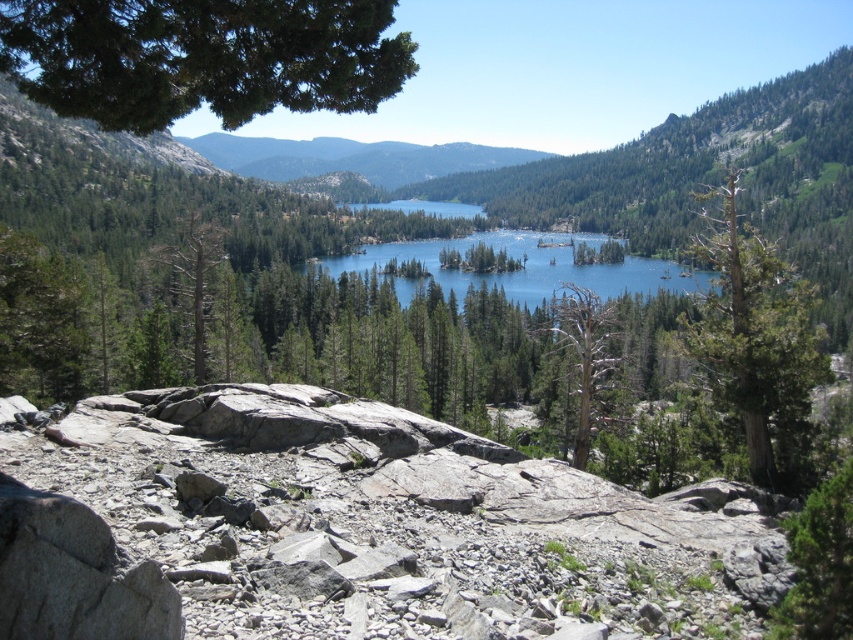
You are standing at the edge of the lake and want to reach the gray rock at center located at point (351,529). Based on the scene description, what obstacles might you encounter along the way?

The path to the gray rock at center at point (351,529) may be obstructed by large boulders and smaller stones scattered across the rocky terrain in the foreground, as well as patches of vegetation growing among them.